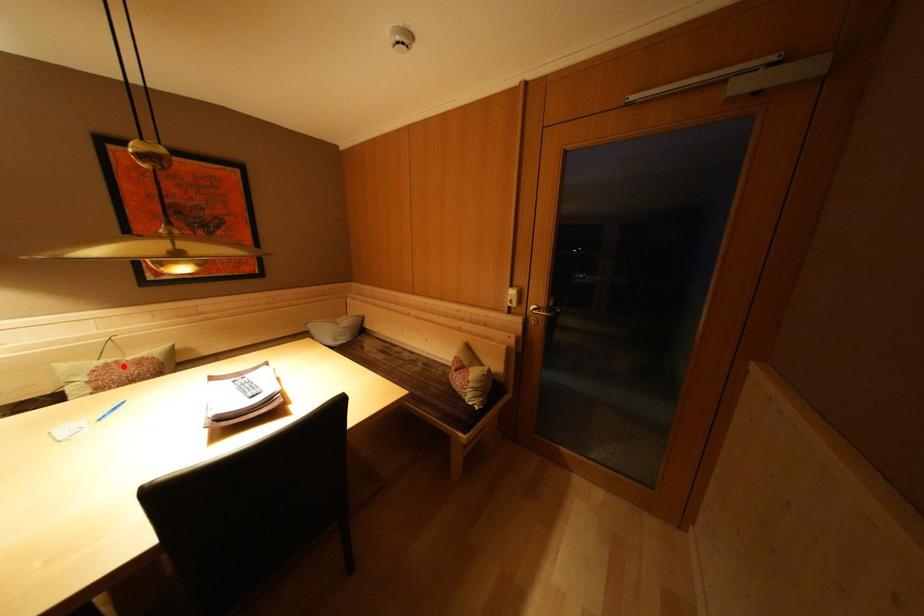
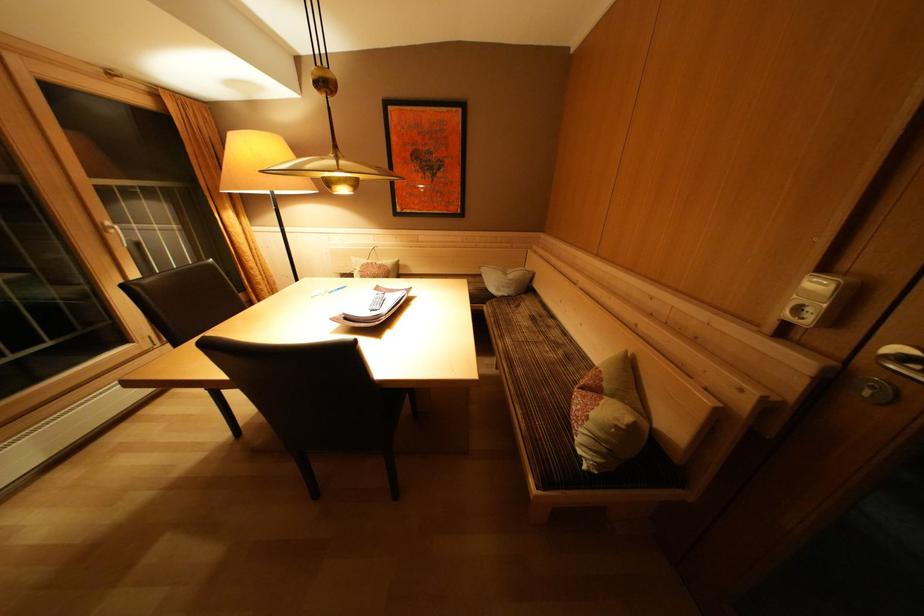
Question: I am providing you with two images of the same scene from different viewpoints. A red point is marked on the first image. At the location where the point appears in image 1, is it still visible in image 2?

Choices:
 (A) Yes
 (B) No

Answer: (A)